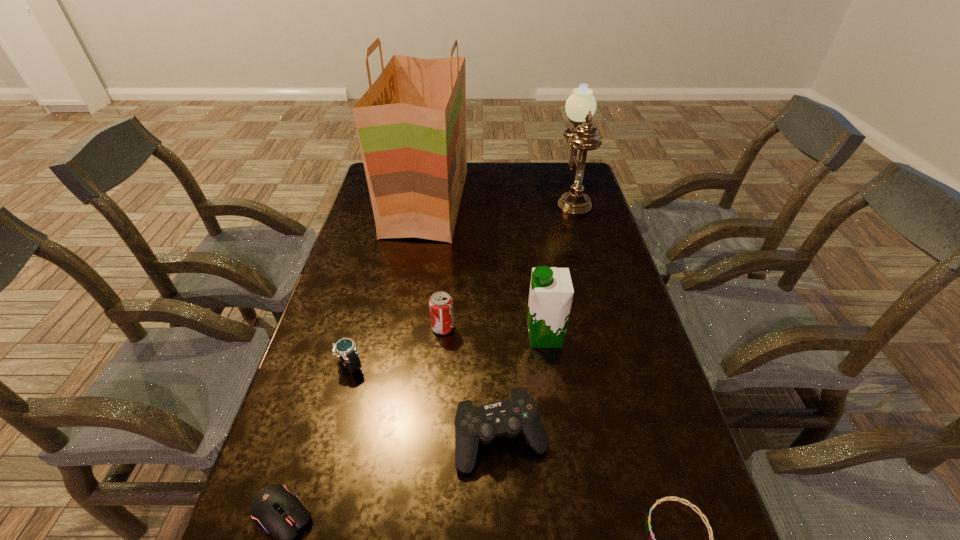
The image size is (960, 540). I want to click on vacant space located on the front-facing side of the third tallest object, so click(476, 336).

Where is `free space located 0.260m on the front-facing side of the third tallest object`? free space located 0.260m on the front-facing side of the third tallest object is located at coordinates (427, 336).

I want to click on free space located 0.280m on the front-facing side of the third tallest object, so click(x=420, y=336).

Where is `vacant space located on the right of the soda can`? This screenshot has width=960, height=540. vacant space located on the right of the soda can is located at coordinates (514, 328).

At what (x,y) coordinates should I click in order to perform the action: click on vacant space situated on the right of the fourth shortest object. Please return your answer as a coordinate pair (x, y). Image resolution: width=960 pixels, height=540 pixels. Looking at the image, I should click on (571, 440).

Find the location of a particular element. free location located on the back of the sixth tallest object is located at coordinates (379, 257).

You are a GUI agent. You are given a task and a screenshot of the screen. Output one action in this format:
    pyautogui.click(x=<x>, y=<y>)
    Task: Click on the grocery bag at the far edge
    
    Given the screenshot: What is the action you would take?
    pyautogui.click(x=411, y=123)

The image size is (960, 540). What are the coordinates of `oil lamp that is at the far edge` in the screenshot? It's located at (580, 106).

The width and height of the screenshot is (960, 540). I want to click on grocery bag at the left edge, so click(411, 123).

Identify the location of watch positioned at the left edge. (344, 348).